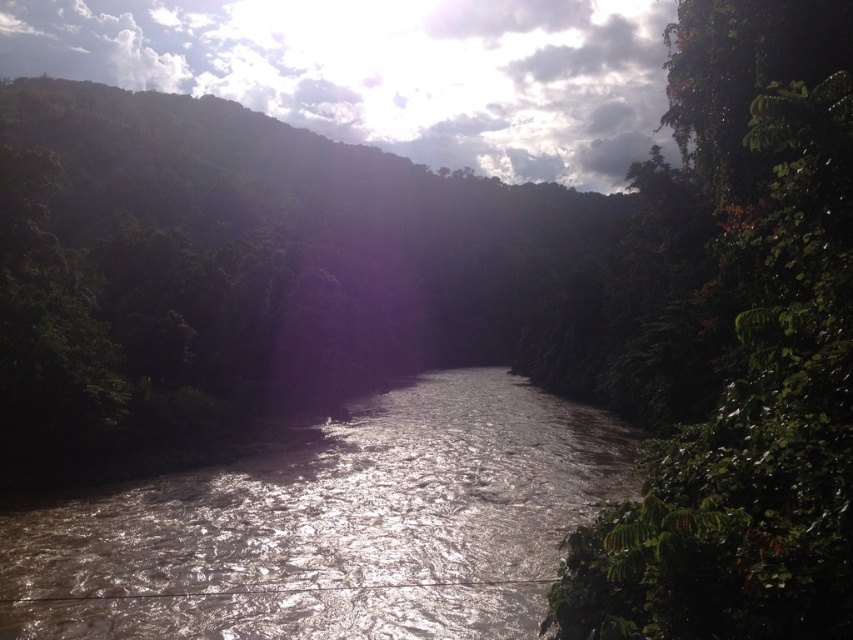
Is green leafy tree at right to the left of brown/muddy water at center from the viewer's perspective?

In fact, green leafy tree at right is to the right of brown/muddy water at center.

Describe the element at coordinates (747, 353) in the screenshot. The width and height of the screenshot is (853, 640). I see `green leafy tree at right` at that location.

Which is behind, point (784, 580) or point (409, 627)?

Positioned behind is point (409, 627).

Where is `green leafy tree at right`? green leafy tree at right is located at coordinates (747, 353).